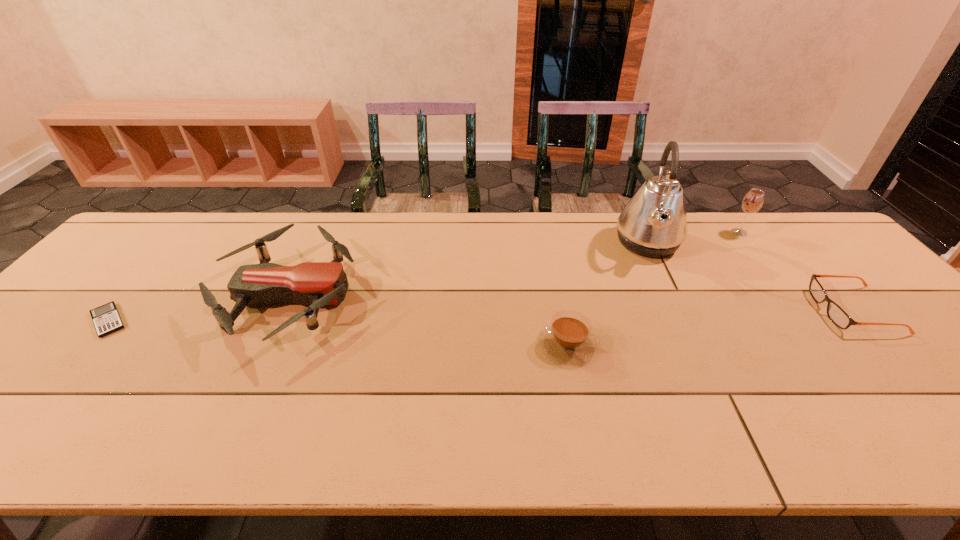
Locate an element on the screen. This screenshot has width=960, height=540. the leftmost object is located at coordinates (106, 319).

At what (x,y) coordinates should I click in order to perform the action: click on the shortest object. Please return your answer as a coordinate pair (x, y). Image resolution: width=960 pixels, height=540 pixels. Looking at the image, I should click on (106, 319).

I want to click on vacant region located on the left of the kettle, so click(x=553, y=243).

This screenshot has width=960, height=540. What are the coordinates of `vacant space situated 0.340m on the left of the second object from right to left` in the screenshot? It's located at (623, 232).

Identify the location of vacant position located on the front-facing side of the third tallest object. (460, 296).

Identify the location of vacant area located 0.230m on the left of the third shortest object. pos(442,345).

Where is `free location located 0.080m on the front-facing side of the rightmost object`? free location located 0.080m on the front-facing side of the rightmost object is located at coordinates (788, 310).

Image resolution: width=960 pixels, height=540 pixels. Find the location of `free spot located 0.240m on the front-facing side of the rightmost object`. free spot located 0.240m on the front-facing side of the rightmost object is located at coordinates (727, 310).

The width and height of the screenshot is (960, 540). Find the location of `free space located on the front-facing side of the rightmost object`. free space located on the front-facing side of the rightmost object is located at coordinates (780, 310).

Find the location of a particular element. free space located 0.080m on the back of the calculator is located at coordinates (140, 284).